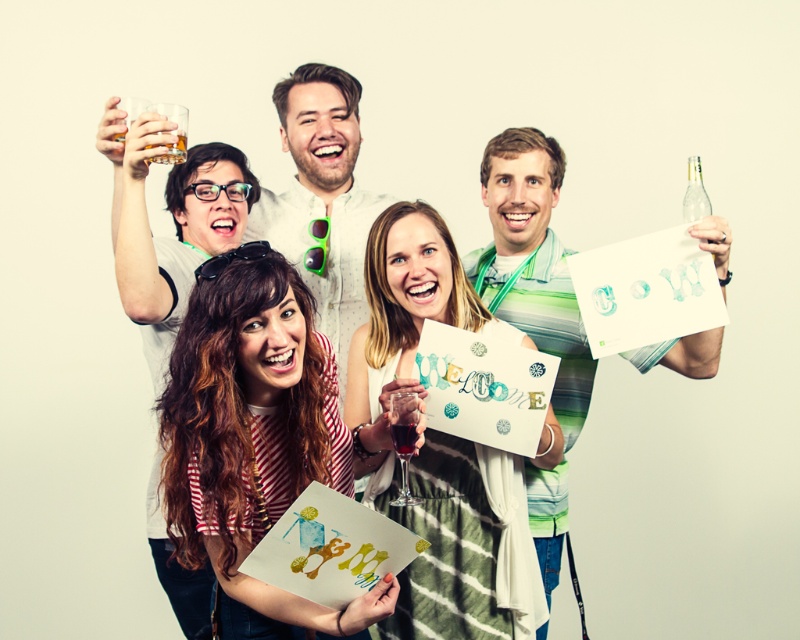
Question: Which of the following is the closest to the observer?

Choices:
 (A) (405, 451)
 (B) (166, 132)

Answer: (A)

Question: From the image, what is the correct spatial relationship of green striped shirt at center in relation to dark red liquid at center?

Choices:
 (A) below
 (B) above

Answer: (B)

Question: Does green striped shirt at center appear over clear glass bottle at upper right?

Choices:
 (A) yes
 (B) no

Answer: (B)

Question: Is the position of matte white shirt at center more distant than that of clear glass bottle at upper right?

Choices:
 (A) yes
 (B) no

Answer: (A)

Question: Which object is positioned farthest from the translucent glass at upper left?

Choices:
 (A) matte white shirt at center
 (B) green striped shirt at center
 (C) clear glass bottle at upper right

Answer: (C)

Question: Based on their relative distances, which object is farther from the matte white shirt at center?

Choices:
 (A) green striped shirt at center
 (B) translucent glass at upper left
 (C) clear glass bottle at upper right
 (D) dark red liquid at center

Answer: (D)